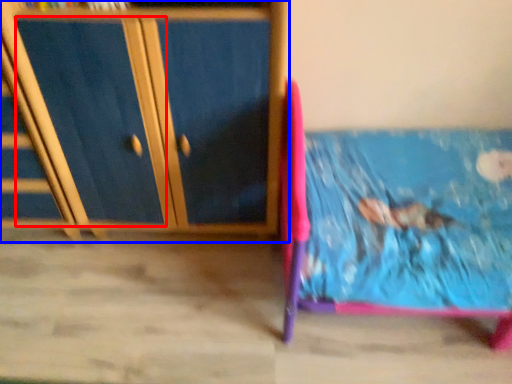
Question: Which point is closer to the camera, drawer (highlighted by a red box) or furniture (highlighted by a blue box)?

Choices:
 (A) drawer
 (B) furniture

Answer: (B)